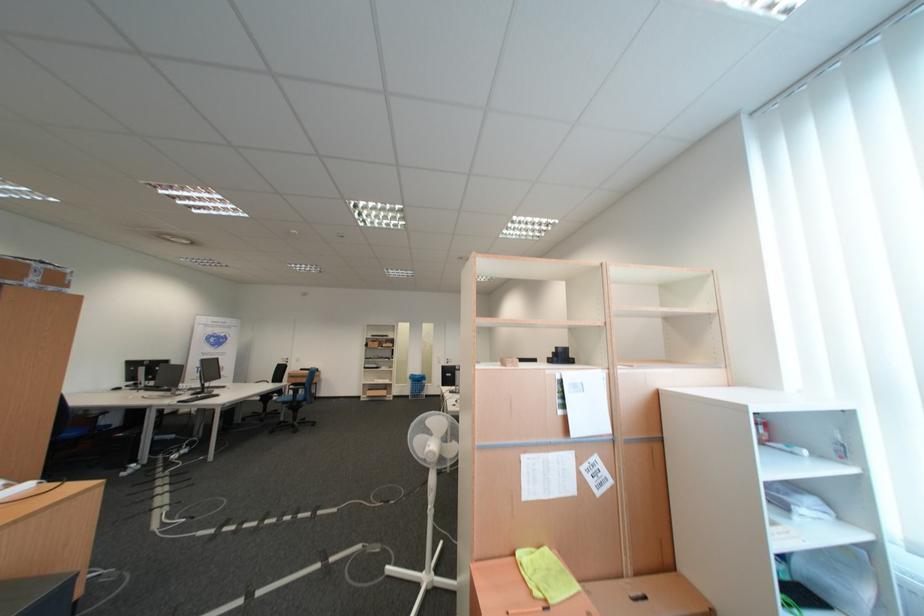
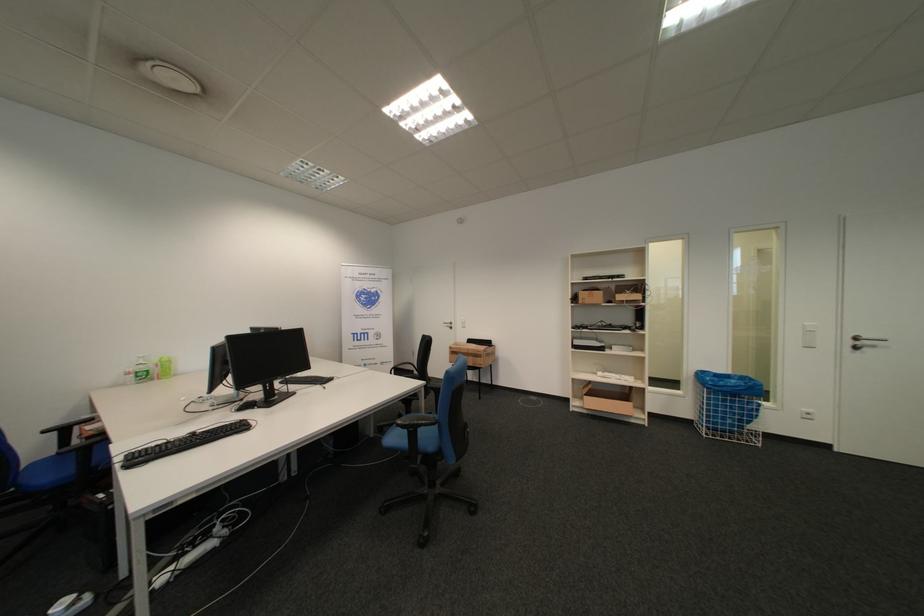
In the second image, find the point that corresponds to (x=317, y=377) in the first image.

(482, 353)